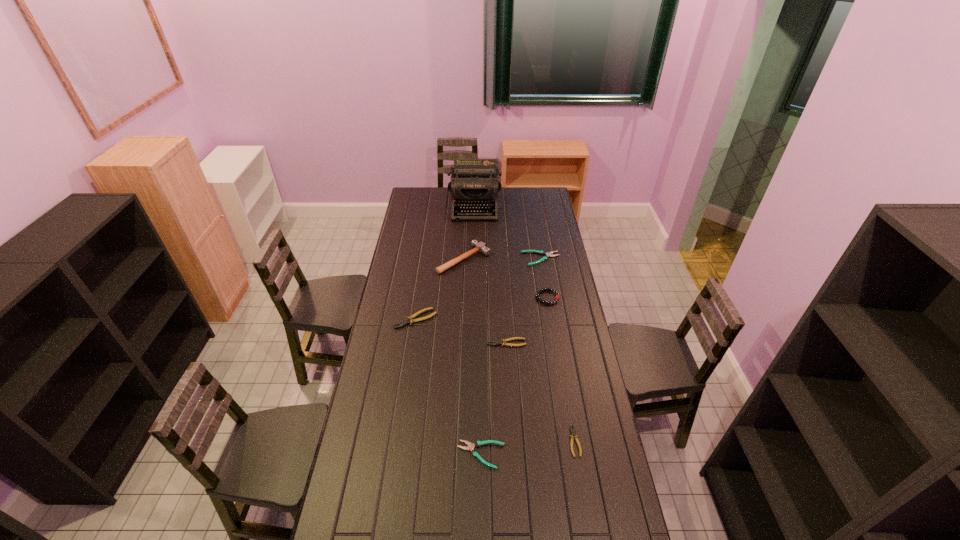
Find the location of a particular element. The width and height of the screenshot is (960, 540). the tallest object is located at coordinates (474, 184).

Find the location of a particular element. The image size is (960, 540). the farthest object is located at coordinates (474, 184).

Locate an element on the screen. The width and height of the screenshot is (960, 540). the second tallest object is located at coordinates (480, 247).

At what (x,y) coordinates should I click in order to perform the action: click on the fourth farthest object. Please return your answer as a coordinate pair (x, y). Looking at the image, I should click on (540, 291).

Where is `the sixth shortest object`? the sixth shortest object is located at coordinates (540, 291).

You are a GUI agent. You are given a task and a screenshot of the screen. Output one action in this format:
    pyautogui.click(x=<x>, y=<y>)
    Task: Click on the fourth nearest object
    This screenshot has height=540, width=960.
    Given the screenshot: What is the action you would take?
    pyautogui.click(x=410, y=319)

This screenshot has width=960, height=540. I want to click on the biggest yellow pliers, so click(x=410, y=319).

At what (x,y) coordinates should I click in order to perform the action: click on the farthest pliers. Please return your answer as a coordinate pair (x, y). The image size is (960, 540). Looking at the image, I should click on (549, 254).

You are a GUI agent. You are given a task and a screenshot of the screen. Output one action in this format:
    pyautogui.click(x=<x>, y=<y>)
    Task: Click on the farther teal pliers
    Image resolution: width=960 pixels, height=540 pixels.
    Given the screenshot: What is the action you would take?
    pyautogui.click(x=549, y=254)

The height and width of the screenshot is (540, 960). Find the location of `the sixth farthest object`. the sixth farthest object is located at coordinates 504,341.